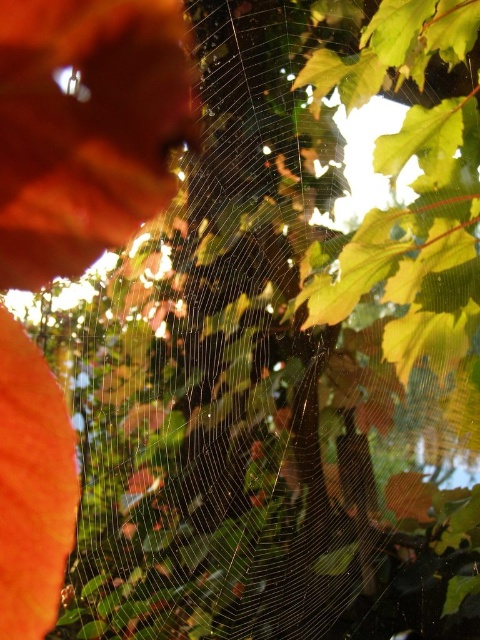
Does matte orange leaf at upper left lie behind orange matte leaf at left?

Yes, matte orange leaf at upper left is behind orange matte leaf at left.

What are the coordinates of `matte orange leaf at upper left` in the screenshot? It's located at (86, 129).